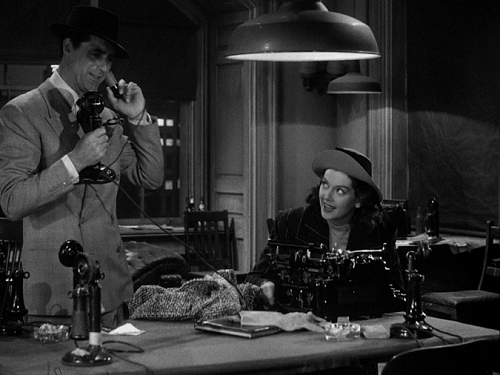
Where is `ceiling lights`? This screenshot has width=500, height=375. ceiling lights is located at coordinates (277, 36), (356, 80).